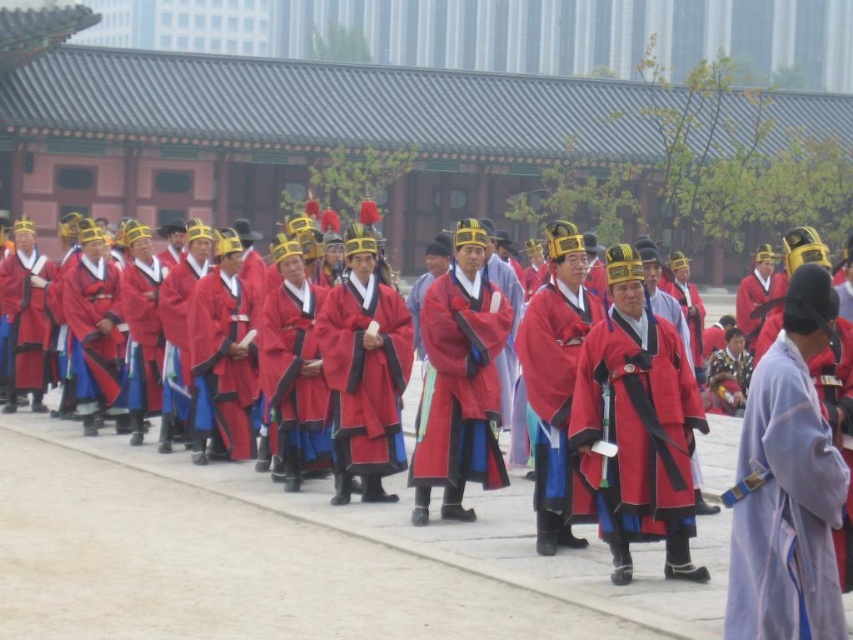
You are a photographer at the ceremony and need to capture both the matte red robe at center and the light purple silk robe at right in a single frame. Since the camera has a fixed focal length, you can only adjust your position. Which direction should you move to ensure both robes are fully visible in the frame?

To include both the matte red robe at center and the light purple silk robe at right in the frame, you should move backward because the matte red robe at center is smaller than the light purple silk robe at right, and adjusting your distance will help balance their sizes within the camera view.

You are organizing a traditional Korean ceremony and need to arrange seating based on robe widths. The participants are wearing a matte red robe at center and a light purple silk robe at right. Which robe belongs to the participant who should sit closer to the front of the ceremony area?

The matte red robe at center should sit closer to the front because its width is less than the light purple silk robe at right, and in traditional ceremonies, narrower robes indicate higher rank which requires front seating.

You are an event planner arranging a photo shoot for a traditional Korean ceremony. You need to position two participants wearing the matte red robe at center and the light purple silk robe at right. Based on their attire, which robe is shorter in length?

The matte red robe at center has a lesser height compared to the light purple silk robe at right, so the matte red robe at center is shorter in length.